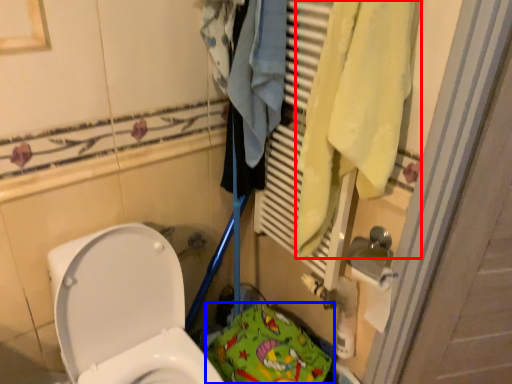
Question: Which point is further to the camera, bath towel (highlighted by a red box) or material (highlighted by a blue box)?

Choices:
 (A) bath towel
 (B) material

Answer: (B)